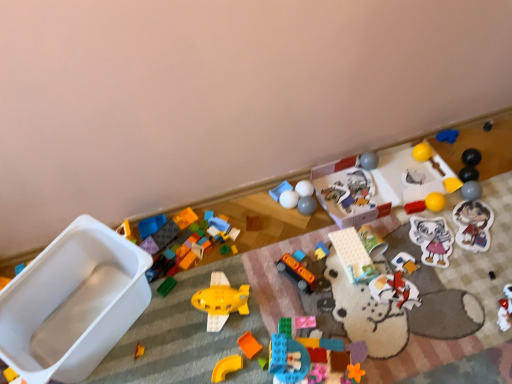
The height and width of the screenshot is (384, 512). Find the location of `free spot in front of matte plastic stickers at lower right, which is counted as the third toy, starting from the right`. free spot in front of matte plastic stickers at lower right, which is counted as the third toy, starting from the right is located at coordinates (478, 274).